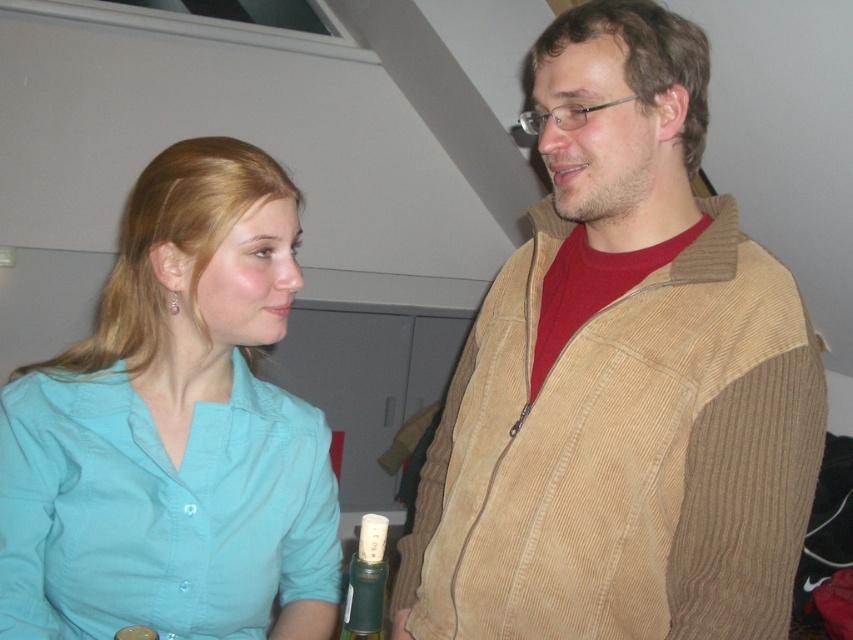
Question: Is corduroy jacket at right wider than teal shirt at center?

Choices:
 (A) yes
 (B) no

Answer: (A)

Question: Which point appears closest to the camera in this image?

Choices:
 (A) (171, 172)
 (B) (560, 205)

Answer: (A)

Question: Can you confirm if corduroy jacket at right is positioned to the left of green matte bottle at lower center?

Choices:
 (A) yes
 (B) no

Answer: (B)

Question: Does corduroy jacket at right have a smaller size compared to teal shirt at center?

Choices:
 (A) no
 (B) yes

Answer: (A)

Question: Which object appears farthest from the camera in this image?

Choices:
 (A) corduroy jacket at right
 (B) green matte bottle at lower center
 (C) teal shirt at center

Answer: (A)

Question: Estimate the real-world distances between objects in this image. Which object is closer to the green matte bottle at lower center?

Choices:
 (A) teal shirt at center
 (B) corduroy jacket at right

Answer: (A)